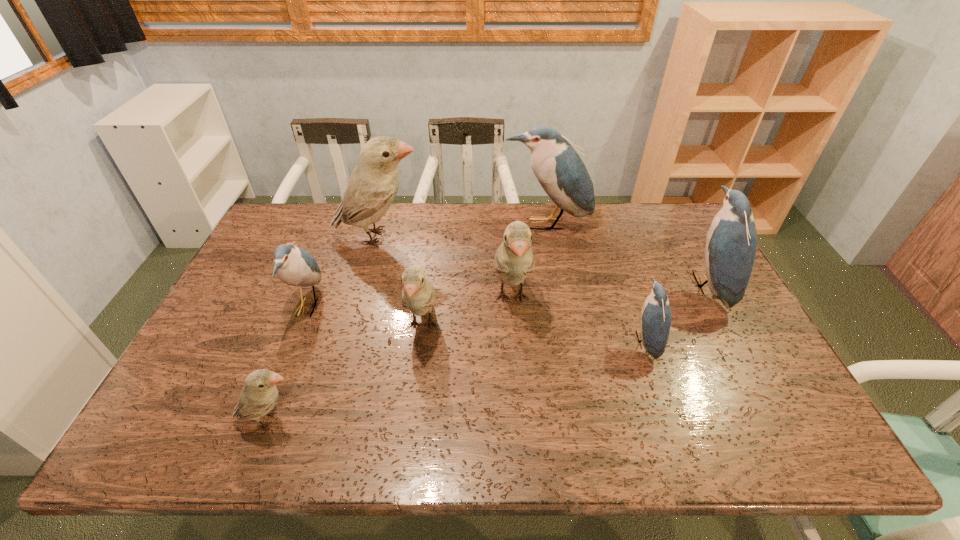
This screenshot has width=960, height=540. In the image, there is a desktop. What are the coordinates of `free space at the far left corner` in the screenshot? It's located at (279, 208).

At what (x,y) coordinates should I click in order to perform the action: click on blank space at the near left corner. Please return your answer as a coordinate pair (x, y). This screenshot has height=540, width=960. Looking at the image, I should click on (193, 430).

The height and width of the screenshot is (540, 960). Identify the location of vacant area that lies between the second bird from right to left and the farthest blue bird. (595, 282).

This screenshot has height=540, width=960. Identify the location of unoccupied position between the second biggest white bird and the nearest object. (391, 359).

The height and width of the screenshot is (540, 960). Identify the location of free space between the nearest white bird and the rightmost white bird. click(x=391, y=359).

Find the location of `free space that is in between the smallest blue bird and the biggest blue bird`. free space that is in between the smallest blue bird and the biggest blue bird is located at coordinates (595, 282).

The height and width of the screenshot is (540, 960). Find the location of `vacant area that lies between the third biggest white bird and the biggest white bird`. vacant area that lies between the third biggest white bird and the biggest white bird is located at coordinates (400, 281).

At what (x,y) coordinates should I click in order to perform the action: click on free spot between the second blue bird from left to right and the third biggest white bird. Please return your answer as a coordinate pair (x, y). The width and height of the screenshot is (960, 540). Looking at the image, I should click on (484, 275).

Locate an element on the screen. vacant space in between the nearest object and the farthest white bird is located at coordinates (324, 328).

Find the location of a particular element. free spot between the smallest white bird and the third biggest white bird is located at coordinates (347, 373).